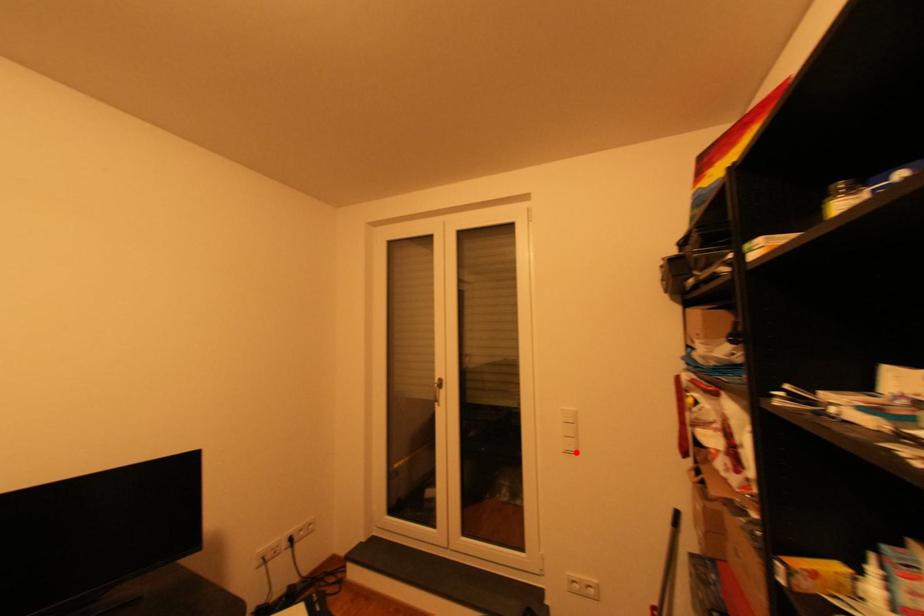
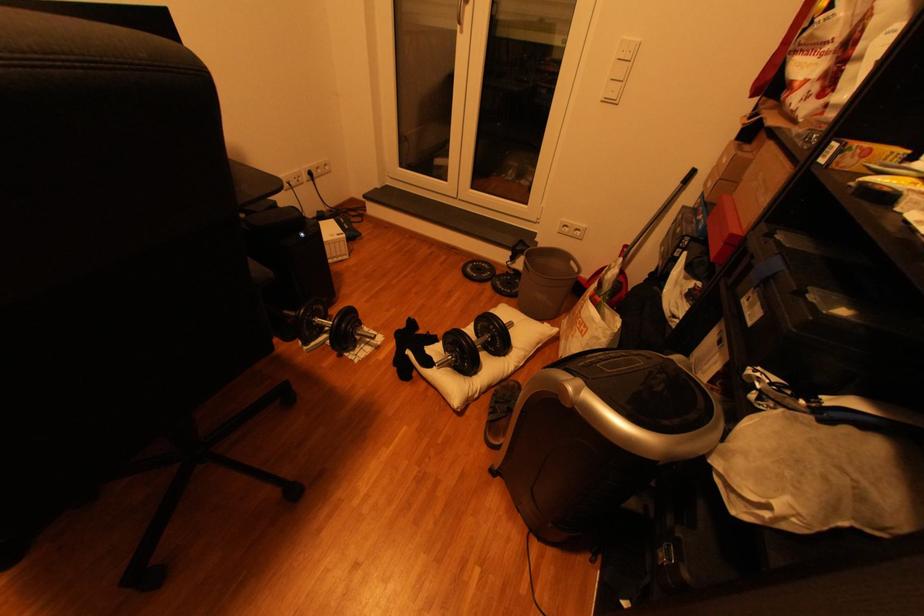
Find the pixel in the second image that matches the highlighted location in the first image.

(614, 100)